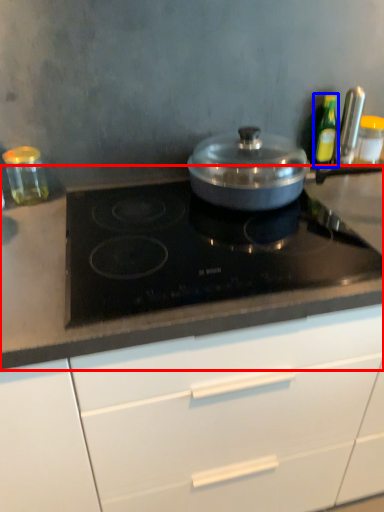
Question: Among these objects, which one is nearest to the camera, countertop (highlighted by a red box) or kitchen appliance (highlighted by a blue box)?

Choices:
 (A) countertop
 (B) kitchen appliance

Answer: (A)